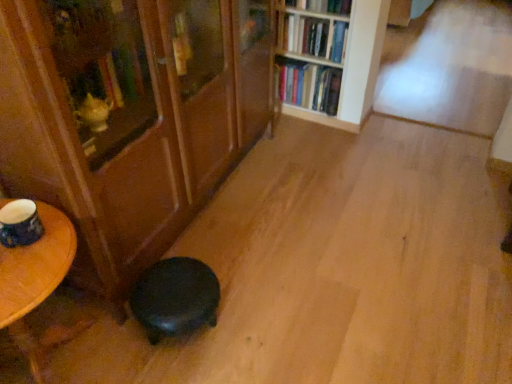
This screenshot has height=384, width=512. I want to click on empty space that is ontop of black matte stool at lower left, so click(x=176, y=284).